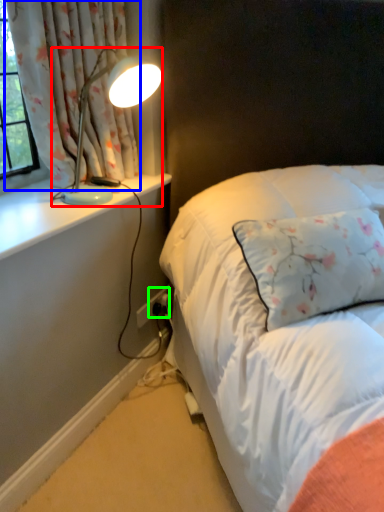
Question: Which is farther away from lamp (highlighted by a red box)? curtain (highlighted by a blue box) or electric outlet (highlighted by a green box)?

Choices:
 (A) curtain
 (B) electric outlet

Answer: (B)